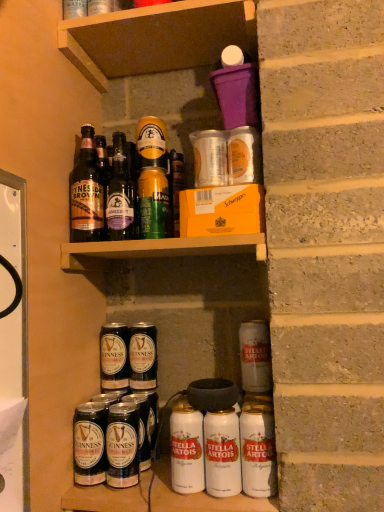
Question: From a real-world perspective, does white matte can at lower right, the 1th beer when ordered from front to back, stand above green matte can at upper center, placed as the 3th yoghurt when sorted from right to left?

Choices:
 (A) no
 (B) yes

Answer: (A)

Question: Is white matte can at lower right, which appears as the fourth beer when viewed from the left, to the left of green matte can at upper center, the first yoghurt positioned from the back, from the viewer's perspective?

Choices:
 (A) no
 (B) yes

Answer: (A)

Question: Is white matte can at lower right, the 1th beer when ordered from front to back, next to green matte can at upper center, which is counted as the 3th yoghurt, starting from the front?

Choices:
 (A) no
 (B) yes

Answer: (A)

Question: Is white matte can at lower right, the 4th beer viewed from the back, shorter than green matte can at upper center, which is counted as the 3th yoghurt, starting from the front?

Choices:
 (A) no
 (B) yes

Answer: (A)

Question: Does white matte can at lower right, which appears as the fourth beer when viewed from the left, have a greater width compared to green matte can at upper center, the 3th yoghurt when ordered from bottom to top?

Choices:
 (A) no
 (B) yes

Answer: (A)

Question: From the image's perspective, is green matte can at upper center, which is counted as the 3th yoghurt, starting from the front, located above or below dark brown glass bottle at center, the second beer in the right-to-left sequence?

Choices:
 (A) below
 (B) above

Answer: (B)

Question: Considering the positions of point (155, 193) and point (140, 326), is point (155, 193) closer or farther from the camera than point (140, 326)?

Choices:
 (A) farther
 (B) closer

Answer: (B)

Question: Choose the correct answer: Is green matte can at upper center, which is counted as the 3th yoghurt, starting from the front, inside dark brown glass bottle at center, the second beer in the right-to-left sequence, or outside it?

Choices:
 (A) inside
 (B) outside

Answer: (B)

Question: Looking at their shapes, would you say green matte can at upper center, which is counted as the 3th yoghurt, starting from the front, is wider or thinner than dark brown glass bottle at center, which is the 2th beer in back-to-front order?

Choices:
 (A) wide
 (B) thin

Answer: (B)

Question: Considering the positions of white matte can at lower right, the 4th beer viewed from the back, and metallic silver can at lower center, which appears as the second yoghurt when ordered from the bottom, in the image, is white matte can at lower right, the 4th beer viewed from the back, wider or thinner than metallic silver can at lower center, which appears as the second yoghurt when ordered from the bottom,?

Choices:
 (A) thin
 (B) wide

Answer: (A)

Question: Is white matte can at lower right, the 4th beer viewed from the back, situated inside metallic silver can at lower center, which appears as the first yoghurt when viewed from the front, or outside?

Choices:
 (A) outside
 (B) inside

Answer: (A)

Question: Relative to metallic silver can at lower center, which appears as the second yoghurt when ordered from the bottom, is white matte can at lower right, which appears as the fourth beer when viewed from the left, in front or behind?

Choices:
 (A) front
 (B) behind

Answer: (A)

Question: From the image's perspective, relative to metallic silver can at lower center, which appears as the first yoghurt when viewed from the front, is white matte can at lower right, the 1th beer when ordered from front to back, above or below?

Choices:
 (A) below
 (B) above

Answer: (B)

Question: From a real-world perspective, is dark brown glass bottle at lower left, the 2th beer in the front-to-back sequence, physically located above or below metallic silver can at lower center, the third yoghurt when ordered from back to front?

Choices:
 (A) below
 (B) above

Answer: (B)

Question: Does point (74, 464) appear closer or farther from the camera than point (210, 458)?

Choices:
 (A) closer
 (B) farther

Answer: (B)